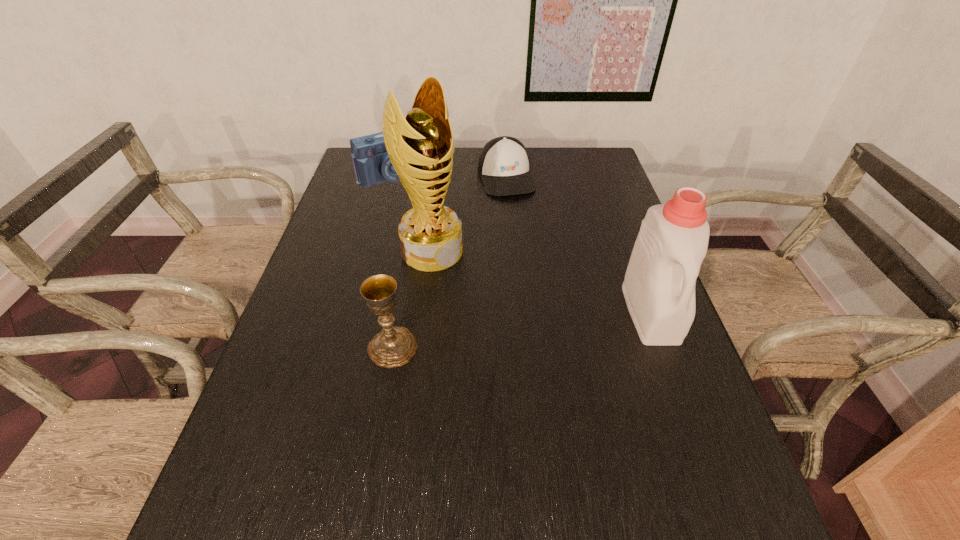
This screenshot has height=540, width=960. Find the location of `the third tallest object`. the third tallest object is located at coordinates click(393, 346).

Where is `detergent`? The image size is (960, 540). detergent is located at coordinates click(659, 286).

I want to click on the rightmost object, so click(659, 286).

What are the coordinates of `award` in the screenshot? It's located at (419, 147).

Find the location of a particular element. This screenshot has width=960, height=540. the third farthest object is located at coordinates (419, 147).

At what (x,y) coordinates should I click in order to perform the action: click on the second object from right to left. Please return your answer as a coordinate pair (x, y). Looking at the image, I should click on (503, 166).

Image resolution: width=960 pixels, height=540 pixels. In order to click on cap in this screenshot , I will do `click(503, 166)`.

Find the location of a particular element. The image size is (960, 540). camera is located at coordinates (372, 166).

This screenshot has height=540, width=960. In order to click on vacant space located on the back of the chalice in this screenshot , I will do `click(411, 246)`.

This screenshot has width=960, height=540. In order to click on free space located 0.210m on the handle side of the rightmost object in this screenshot , I will do `click(698, 440)`.